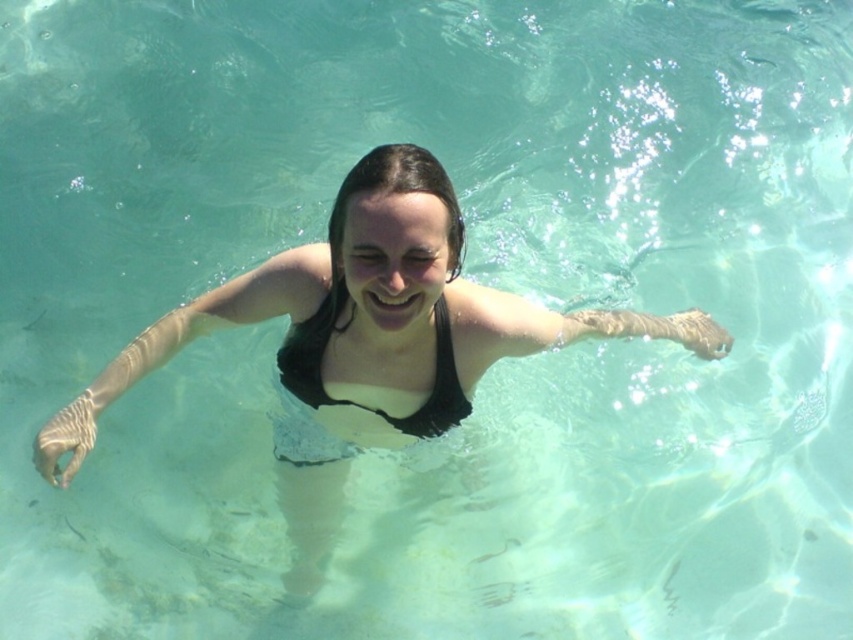
You are a photographer trying to capture the swimmer in the center. You need to know the position of the black matte swimsuit at center relative to the black matte bikini top at center. Which side is the swimsuit located on?

The black matte swimsuit at center is to the right of the black matte bikini top at center.

You are a lifeguard on duty and need to ensure swimwear compliance. The rule states that swimwear must be a single piece without separate components. You observe a swimmer wearing the black matte swimsuit at center and the black matte bikini top at center. Are they violating the rule?

The black matte swimsuit at center and the black matte bikini top at center are separate components since they are 6.95 inches apart, indicating the swimmer is violating the rule.

From the picture: You are a photographer trying to capture the perfect shot of the black matte swimsuit at center. Based on its position coordinates, where should you aim your camera?

The black matte swimsuit at center is located at coordinates point (368, 323), so you should aim your camera at that specific point to capture it.